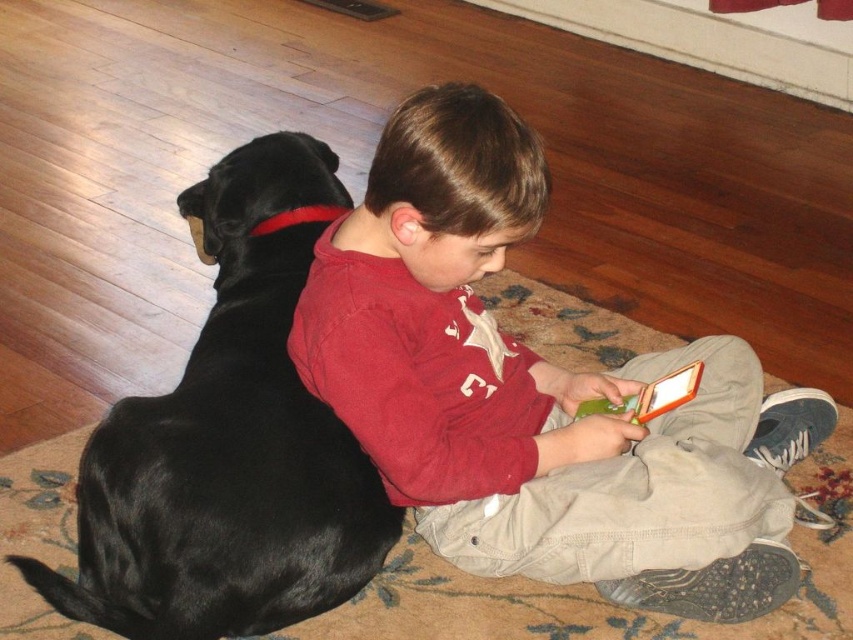
Between matte red shirt at center and black shiny fur at left, which one is positioned lower?

Positioned lower is matte red shirt at center.

This screenshot has width=853, height=640. What do you see at coordinates (535, 392) in the screenshot? I see `matte red shirt at center` at bounding box center [535, 392].

Does point (728, 608) come in front of point (175, 563)?

No.

Locate an element on the screen. This screenshot has width=853, height=640. matte red shirt at center is located at coordinates (535, 392).